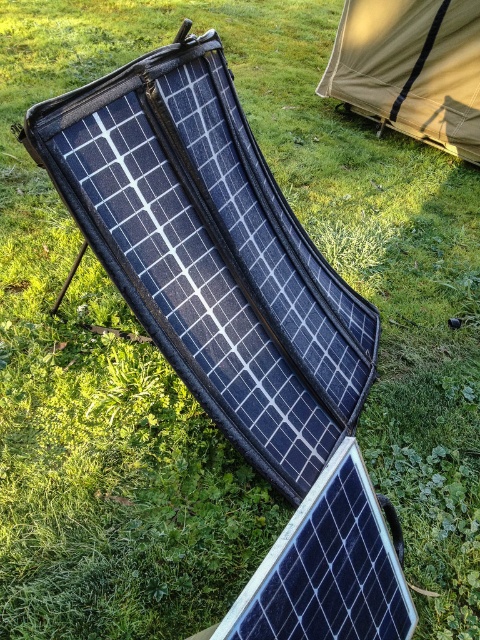
Question: Is black textured solar panel at center below tan canvas tent at upper right?

Choices:
 (A) no
 (B) yes

Answer: (B)

Question: Where is black textured solar panel at center located in relation to tan canvas tent at upper right in the image?

Choices:
 (A) below
 (B) above

Answer: (A)

Question: Which point is farther from the camera taking this photo?

Choices:
 (A) (344, 540)
 (B) (351, 48)

Answer: (B)

Question: Is black textured solar panel at center closer to camera compared to tan canvas tent at upper right?

Choices:
 (A) yes
 (B) no

Answer: (A)

Question: Which object appears farthest from the camera in this image?

Choices:
 (A) black textured solar panel at center
 (B) tan canvas tent at upper right

Answer: (B)

Question: Which of the following is the closest to the observer?

Choices:
 (A) tan canvas tent at upper right
 (B) black textured solar panel at center

Answer: (B)